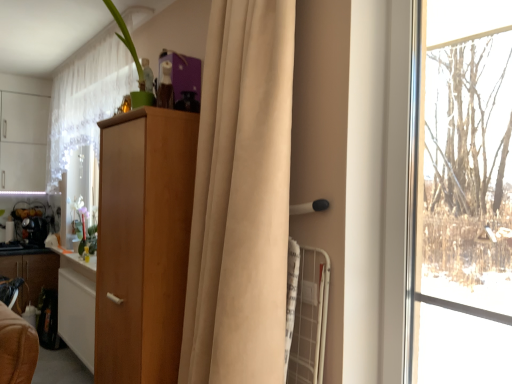
What do you see at coordinates (143, 243) in the screenshot? This screenshot has width=512, height=384. I see `light brown wood cabinet at center, the first cabinetry in the front-to-back sequence` at bounding box center [143, 243].

The height and width of the screenshot is (384, 512). What do you see at coordinates (126, 41) in the screenshot? I see `green matte plant at upper left` at bounding box center [126, 41].

Locate an element on the screen. The height and width of the screenshot is (384, 512). white sheer curtain at upper left, placed as the second curtain when sorted from right to left is located at coordinates (87, 100).

What do you see at coordinates (35, 231) in the screenshot? I see `black plastic coffee maker at left, the 1th appliance viewed from the front` at bounding box center [35, 231].

Locate an element on the screen. light brown wood cabinet at center, the first cabinetry from the right is located at coordinates (143, 243).

Does wooden cabinet at left, placed as the first cabinetry when sorted from left to right, appear on the left side of light brown wood cabinet at center, the 2th cabinetry viewed from the back?

Indeed, wooden cabinet at left, placed as the first cabinetry when sorted from left to right, is positioned on the left side of light brown wood cabinet at center, the 2th cabinetry viewed from the back.

Is wooden cabinet at left, marked as the second cabinetry in a right-to-left arrangement, positioned beyond the bounds of light brown wood cabinet at center, the first cabinetry in the front-to-back sequence?

wooden cabinet at left, marked as the second cabinetry in a right-to-left arrangement, is positioned outside light brown wood cabinet at center, the first cabinetry in the front-to-back sequence.

Is wooden cabinet at left, arranged as the 1th cabinetry when viewed from the back, closer to the viewer compared to light brown wood cabinet at center, the 2th cabinetry from the left?

No, wooden cabinet at left, arranged as the 1th cabinetry when viewed from the back, is further to the viewer.

Considering the sizes of objects wooden cabinet at left, the 2th cabinetry positioned from the front, and light brown wood cabinet at center, the first cabinetry in the front-to-back sequence, in the image provided, who is taller, wooden cabinet at left, the 2th cabinetry positioned from the front, or light brown wood cabinet at center, the first cabinetry in the front-to-back sequence,?

light brown wood cabinet at center, the first cabinetry in the front-to-back sequence, is taller.

From the image's perspective, is metallic silver kettle at left, which is the 2th appliance from front to back, beneath black plastic coffee maker at left, the 2th appliance viewed from the back?

No, from the image's perspective, metallic silver kettle at left, which is the 2th appliance from front to back, is not beneath black plastic coffee maker at left, the 2th appliance viewed from the back.

Is metallic silver kettle at left, which is the 2th appliance from front to back, spatially inside black plastic coffee maker at left, the 1th appliance viewed from the front, or outside of it?

metallic silver kettle at left, which is the 2th appliance from front to back, lies outside black plastic coffee maker at left, the 1th appliance viewed from the front.

Can you confirm if metallic silver kettle at left, marked as the 1th appliance in a back-to-front arrangement, is positioned to the left of black plastic coffee maker at left, the 1th appliance viewed from the front?

Yes, metallic silver kettle at left, marked as the 1th appliance in a back-to-front arrangement, is to the left of black plastic coffee maker at left, the 1th appliance viewed from the front.

Does metallic silver kettle at left, marked as the 1th appliance in a back-to-front arrangement, turn towards black plastic coffee maker at left, the 2th appliance viewed from the back?

Yes.

Could you measure the distance between green matte plant at upper left and black plastic coffee maker at left, the 1th appliance viewed from the front?

A distance of 9.10 feet exists between green matte plant at upper left and black plastic coffee maker at left, the 1th appliance viewed from the front.

Does point (127, 35) appear closer or farther from the camera than point (27, 231)?

Point (127, 35) is positioned closer to the camera compared to point (27, 231).

Consider the image. Does green matte plant at upper left have a greater width compared to black plastic coffee maker at left, the 1th appliance viewed from the front?

No, green matte plant at upper left is not wider than black plastic coffee maker at left, the 1th appliance viewed from the front.

Is translucent glass vase at left far away from beige fabric curtain at center, positioned as the 2th curtain in back-to-front order?

Yes, translucent glass vase at left and beige fabric curtain at center, positioned as the 2th curtain in back-to-front order, are located far from each other.

From the image's perspective, relative to beige fabric curtain at center, positioned as the 1th curtain in front-to-back order, is translucent glass vase at left above or below?

Clearly, from the image's perspective, translucent glass vase at left is below beige fabric curtain at center, positioned as the 1th curtain in front-to-back order.

Which of these two, translucent glass vase at left or beige fabric curtain at center, positioned as the 1th curtain in front-to-back order, is thinner?

translucent glass vase at left is thinner.

Considering the relative positions of translucent glass vase at left and beige fabric curtain at center, the second curtain viewed from the left, in the image provided, is translucent glass vase at left to the left or to the right of beige fabric curtain at center, the second curtain viewed from the left,?

translucent glass vase at left is to the left of beige fabric curtain at center, the second curtain viewed from the left.

Between light brown wood cabinet at center, the first cabinetry in the front-to-back sequence, and green matte plant at upper left, which one is positioned behind?

light brown wood cabinet at center, the first cabinetry in the front-to-back sequence, is further from the camera.

Consider the image. Considering the sizes of objects light brown wood cabinet at center, the 2th cabinetry viewed from the back, and green matte plant at upper left in the image provided, who is thinner, light brown wood cabinet at center, the 2th cabinetry viewed from the back, or green matte plant at upper left?

With smaller width is green matte plant at upper left.

From a real-world perspective, between light brown wood cabinet at center, the 2th cabinetry viewed from the back, and green matte plant at upper left, who is vertically higher?

In real-world perspective, green matte plant at upper left is above.

Considering the points (169, 176) and (133, 47), which point is behind, point (169, 176) or point (133, 47)?

Point (133, 47)

Does wooden cabinet at left, the 2th cabinetry positioned from the front, come behind white sheer curtain at upper left, the second curtain viewed from the front?

Yes, wooden cabinet at left, the 2th cabinetry positioned from the front, is further from the camera.

Between wooden cabinet at left, placed as the first cabinetry when sorted from left to right, and white sheer curtain at upper left, the second curtain viewed from the front, which one has smaller width?

Thinner between the two is wooden cabinet at left, placed as the first cabinetry when sorted from left to right.

Locate an element on the screen. The width and height of the screenshot is (512, 384). cabinetry that is on the left side of white sheer curtain at upper left, placed as the second curtain when sorted from right to left is located at coordinates (77, 314).

Considering the points (63, 315) and (252, 40), which point is in front, point (63, 315) or point (252, 40)?

Positioned in front is point (252, 40).

In terms of height, does wooden cabinet at left, placed as the first cabinetry when sorted from left to right, look taller or shorter compared to beige fabric curtain at center, positioned as the 2th curtain in back-to-front order?

Considering their sizes, wooden cabinet at left, placed as the first cabinetry when sorted from left to right, has less height than beige fabric curtain at center, positioned as the 2th curtain in back-to-front order.

From the image's perspective, which curtain is the 1st one above the wooden cabinet at left, placed as the first cabinetry when sorted from left to right? Please provide its 2D coordinates.

[(241, 198)]

Locate an element on the screen. The width and height of the screenshot is (512, 384). cabinetry that is above the wooden cabinet at left, arranged as the 1th cabinetry when viewed from the back (from a real-world perspective) is located at coordinates (143, 243).

I want to click on appliance located on the right of metallic silver kettle at left, marked as the 1th appliance in a back-to-front arrangement, so click(35, 231).

Which object lies further to the anchor point wooden cabinet at left, the 2th cabinetry positioned from the front, white sheer curtain at upper left, the second curtain viewed from the front, or green matte plant at upper left?

green matte plant at upper left lies further to wooden cabinet at left, the 2th cabinetry positioned from the front, than the other object.

Which object lies further to the anchor point white sheer curtain at upper left, positioned as the 1th curtain in back-to-front order, metallic silver kettle at left, which is the 2th appliance from front to back, or wooden cabinet at left, arranged as the 1th cabinetry when viewed from the back?

The object further to white sheer curtain at upper left, positioned as the 1th curtain in back-to-front order, is wooden cabinet at left, arranged as the 1th cabinetry when viewed from the back.

Estimate the real-world distances between objects in this image. Which object is further from white sheer curtain at upper left, acting as the 1th curtain starting from the left, beige fabric curtain at center, positioned as the 1th curtain in front-to-back order, or green matte plant at upper left?

The object further to white sheer curtain at upper left, acting as the 1th curtain starting from the left, is beige fabric curtain at center, positioned as the 1th curtain in front-to-back order.

From the image, which object appears to be nearer to translucent glass vase at left, light brown wood cabinet at center, the 2th cabinetry from the left, or wooden cabinet at left, the 2th cabinetry positioned from the front?

Among the two, wooden cabinet at left, the 2th cabinetry positioned from the front, is located nearer to translucent glass vase at left.

Estimate the real-world distances between objects in this image. Which object is further from translucent glass vase at left, green matte plant at upper left or beige fabric curtain at center, positioned as the 1th curtain in front-to-back order?

Among the two, beige fabric curtain at center, positioned as the 1th curtain in front-to-back order, is located further to translucent glass vase at left.

Considering their positions, is metallic silver kettle at left, which is the 2th appliance from front to back, positioned further to white sheer curtain at upper left, placed as the second curtain when sorted from right to left, than black plastic coffee maker at left, the 1th appliance viewed from the front?

Based on the image, black plastic coffee maker at left, the 1th appliance viewed from the front, appears to be further to white sheer curtain at upper left, placed as the second curtain when sorted from right to left.

When comparing their distances from white sheer curtain at upper left, positioned as the 1th curtain in back-to-front order, does light brown wood cabinet at center, the first cabinetry from the right, or translucent glass vase at left seem further?

light brown wood cabinet at center, the first cabinetry from the right, lies further to white sheer curtain at upper left, positioned as the 1th curtain in back-to-front order, than the other object.

Based on their spatial positions, is green matte plant at upper left or white sheer curtain at upper left, acting as the 1th curtain starting from the left, further from translucent glass vase at left?

green matte plant at upper left.

Where is `cabinetry between white sheer curtain at upper left, positioned as the 1th curtain in back-to-front order, and wooden cabinet at left, placed as the first cabinetry when sorted from left to right, vertically`? cabinetry between white sheer curtain at upper left, positioned as the 1th curtain in back-to-front order, and wooden cabinet at left, placed as the first cabinetry when sorted from left to right, vertically is located at coordinates (143, 243).

Find the location of a particular element. This screenshot has height=384, width=512. cabinetry between white sheer curtain at upper left, the second curtain viewed from the front, and metallic silver kettle at left, which is the 2th appliance from front to back, in the front-back direction is located at coordinates (77, 314).

Find the location of a particular element. curtain between light brown wood cabinet at center, the first cabinetry from the right, and translucent glass vase at left in the front-back direction is located at coordinates (87, 100).

Locate an element on the screen. Image resolution: width=512 pixels, height=384 pixels. floral arrangement between white sheer curtain at upper left, the second curtain viewed from the front, and wooden cabinet at left, marked as the second cabinetry in a right-to-left arrangement, from top to bottom is located at coordinates (84, 227).